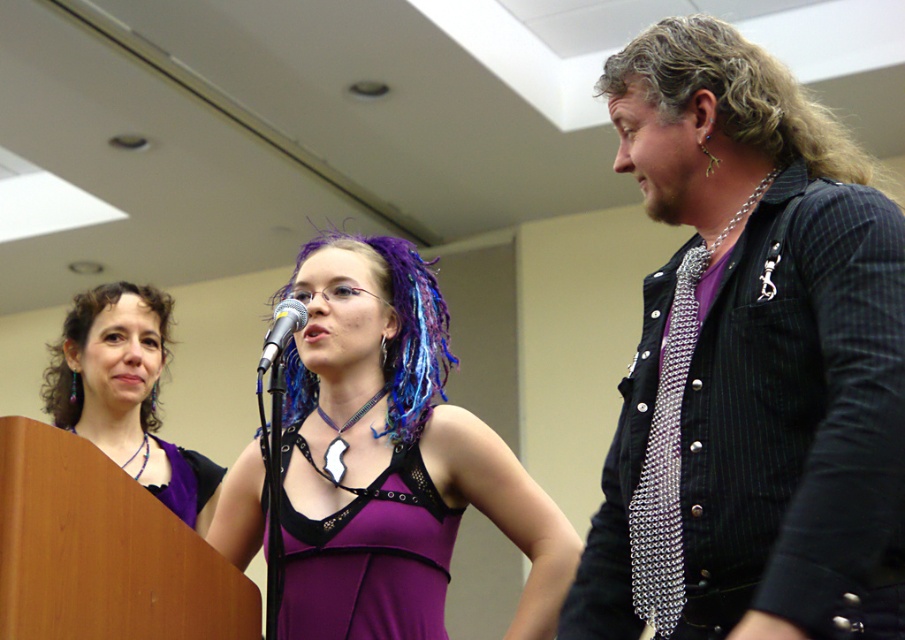
Question: Which of the following is the farthest from the observer?

Choices:
 (A) (761, 120)
 (B) (137, 365)
 (C) (140, 291)

Answer: (C)

Question: Among these objects, which one is farthest from the camera?

Choices:
 (A) purple dyed hair at center
 (B) purple satin dress at center

Answer: (A)

Question: Is metallic chainmail vest at right positioned in front of curly brown hair at left?

Choices:
 (A) yes
 (B) no

Answer: (A)

Question: Does curly blonde hair at upper right come behind metallic silver microphone at center?

Choices:
 (A) no
 (B) yes

Answer: (A)

Question: Is metallic chainmail vest at right positioned at the back of curly blonde hair at upper right?

Choices:
 (A) yes
 (B) no

Answer: (B)

Question: Which point appears farthest from the camera in this image?

Choices:
 (A) (176, 509)
 (B) (719, 52)

Answer: (A)